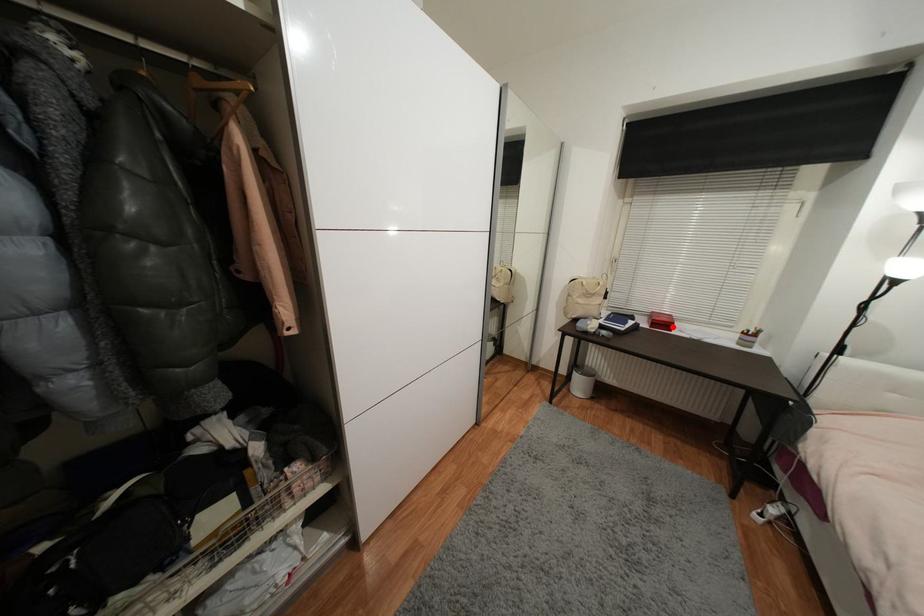
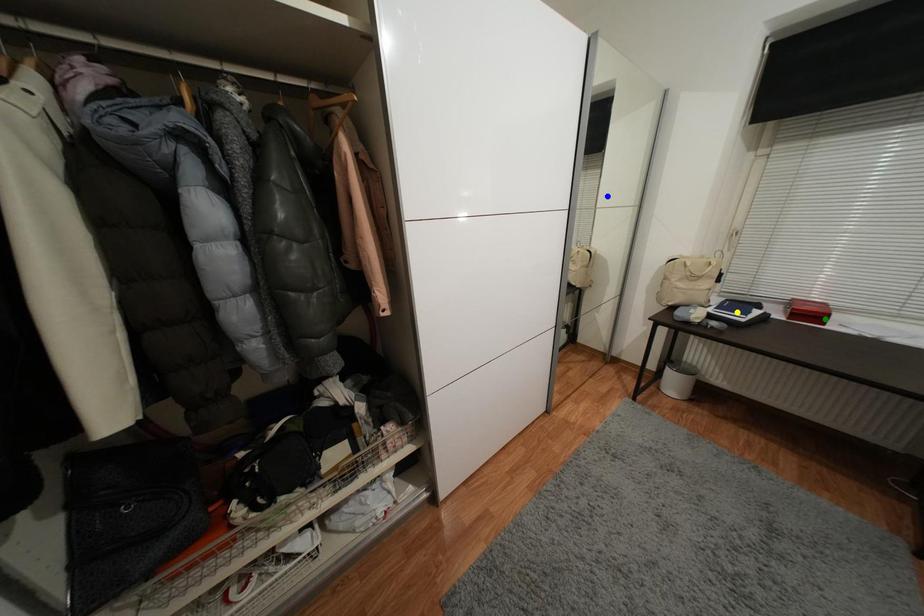
Question: I am providing you with two images of the same scene from different viewpoints. A red point is marked on the first image. You are given multiple points on the second image. Which mark in image 2 goes with the point in image 1?

Choices:
 (A) yellow point
 (B) green point
 (C) blue point

Answer: (B)